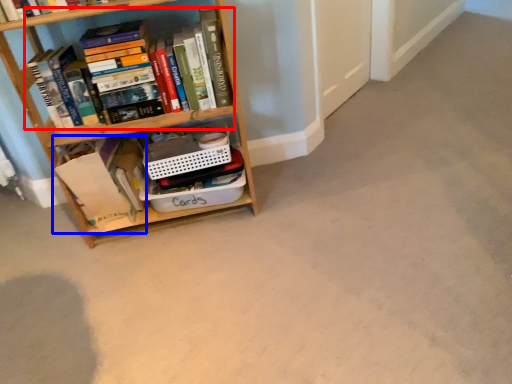
Question: Which object is closer to the camera taking this photo, book (highlighted by a red box) or book (highlighted by a blue box)?

Choices:
 (A) book
 (B) book

Answer: (A)